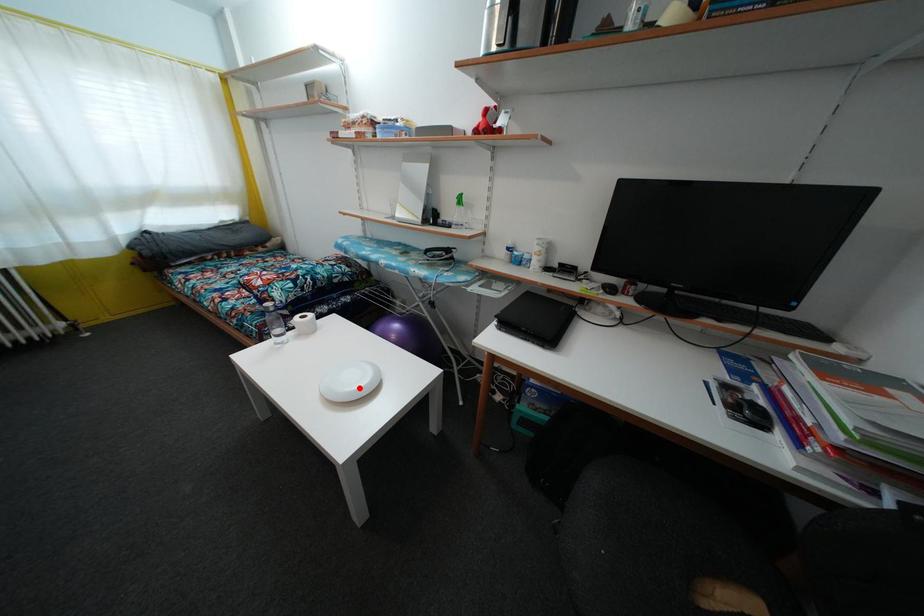
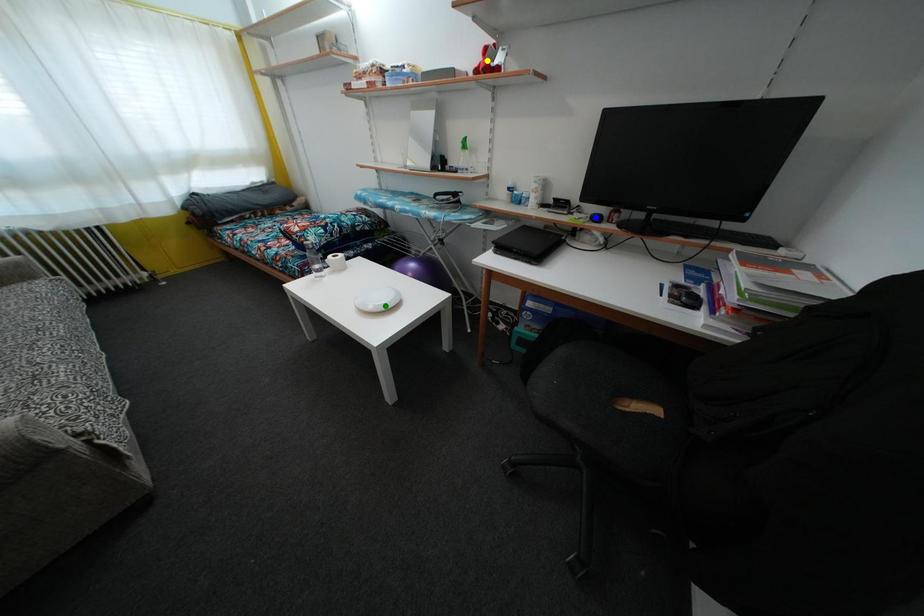
Question: I am providing you with two images of the same scene from different viewpoints. A red point is marked on the first image. You are given multiple points on the second image. Which point in image 2 represents the same 3d spot as the red point in image 1?

Choices:
 (A) blue point
 (B) yellow point
 (C) green point

Answer: (C)